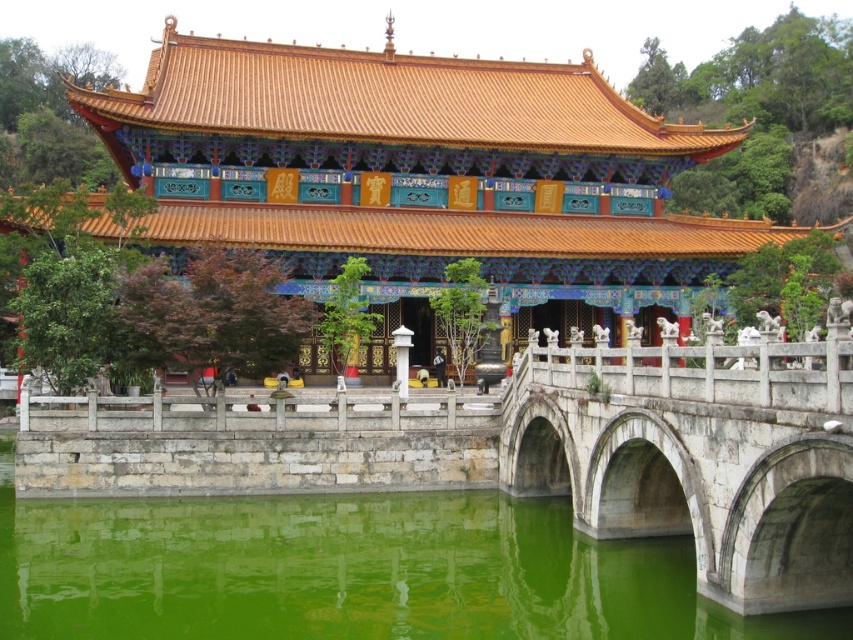
Based on the photo, is shiny gold roof at center smaller than white stone bridge at center?

Actually, shiny gold roof at center might be larger than white stone bridge at center.

Who is shorter, shiny gold roof at center or white stone bridge at center?

Standing shorter between the two is white stone bridge at center.

What do you see at coordinates (421, 168) in the screenshot?
I see `shiny gold roof at center` at bounding box center [421, 168].

Identify the location of shiny gold roof at center. This screenshot has height=640, width=853. (421, 168).